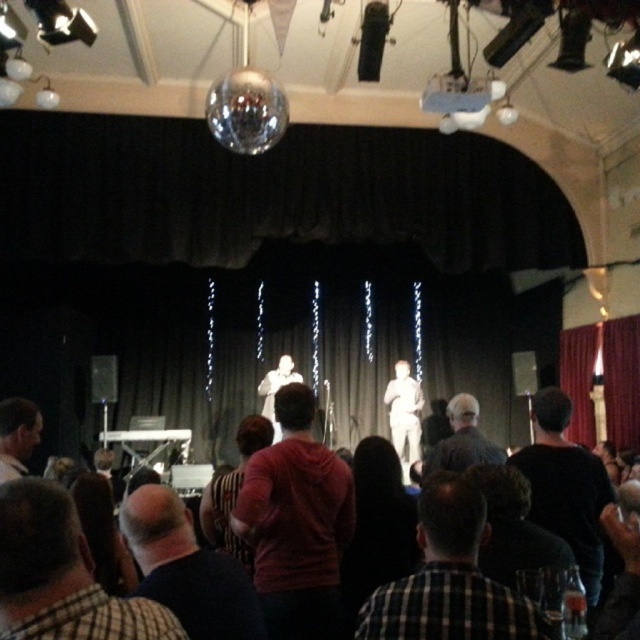
You are an event planner standing at the back of the venue and need to place two decorations at the coordinates point (x=308, y=616) and point (x=609, y=499). Which decoration will be closer to the audience seated in front?

Point (x=308, y=616) is in front of point (x=609, y=499), so the decoration placed at point (x=308, y=616) will be closer to the audience seated in front.

You are an event organizer and need to place a new speaker on stage. The current speakers are standing near the red hoodie at center. Where should you position the new speaker to ensure they are visible to the audience?

Since the red hoodie at center is located at point [296,522], positioning the new speaker to the side or slightly behind this position would keep them visible while maintaining stage symmetry.

You are an event planner trying to arrange a new speaker on stage. There is a smooth black shirt at lower left represented by point (17, 435). Where should you place the new speaker so they are not too close to the existing speaker wearing the smooth black shirt at lower left?

Answer: Place the new speaker away from the point (17, 435) to avoid being too close to the existing speaker in the smooth black shirt at lower left.